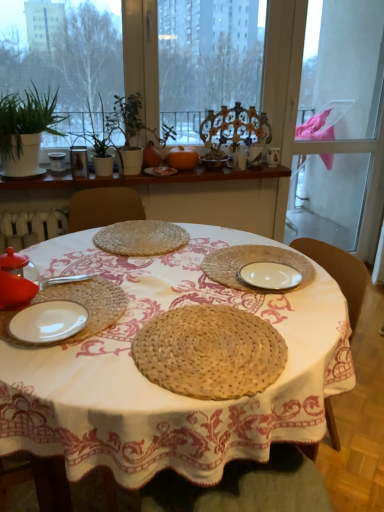
Find the location of a particular element. The image size is (384, 512). vacant area on top of white matte plate at lower left, acting as the first plate starting from the front (from a real-world perspective) is located at coordinates (44, 312).